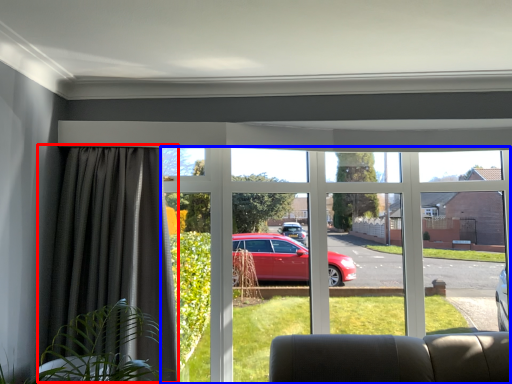
Question: Among these objects, which one is nearest to the camera, curtain (highlighted by a red box) or window (highlighted by a blue box)?

Choices:
 (A) curtain
 (B) window

Answer: (A)